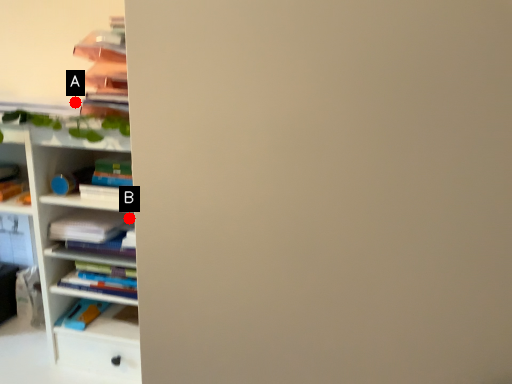
Question: Two points are circled on the image, labeled by A and B beside each circle. Which point is closer to the camera?

Choices:
 (A) A is closer
 (B) B is closer

Answer: (B)